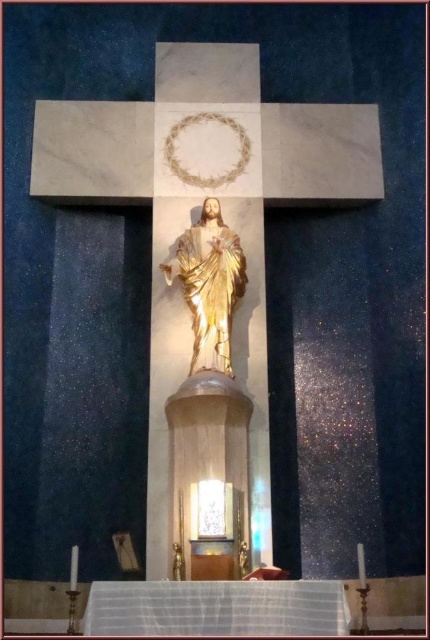
Question: Can you confirm if gold leaf statue at center is smaller than gold polished statue at center?

Choices:
 (A) no
 (B) yes

Answer: (A)

Question: Is gold leaf statue at center thinner than gold polished statue at center?

Choices:
 (A) yes
 (B) no

Answer: (B)

Question: Is gold leaf statue at center wider than gold polished statue at center?

Choices:
 (A) yes
 (B) no

Answer: (A)

Question: Which point appears farthest from the camera in this image?

Choices:
 (A) (359, 593)
 (B) (217, 253)

Answer: (B)